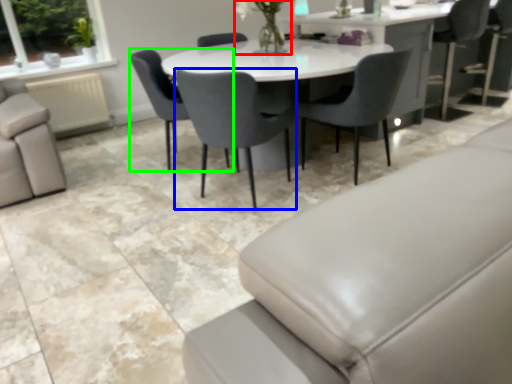
Question: Based on their relative distances, which object is nearer to floral arrangement (highlighted by a red box)? Choose from chair (highlighted by a blue box) and chair (highlighted by a green box).

Choices:
 (A) chair
 (B) chair

Answer: (B)